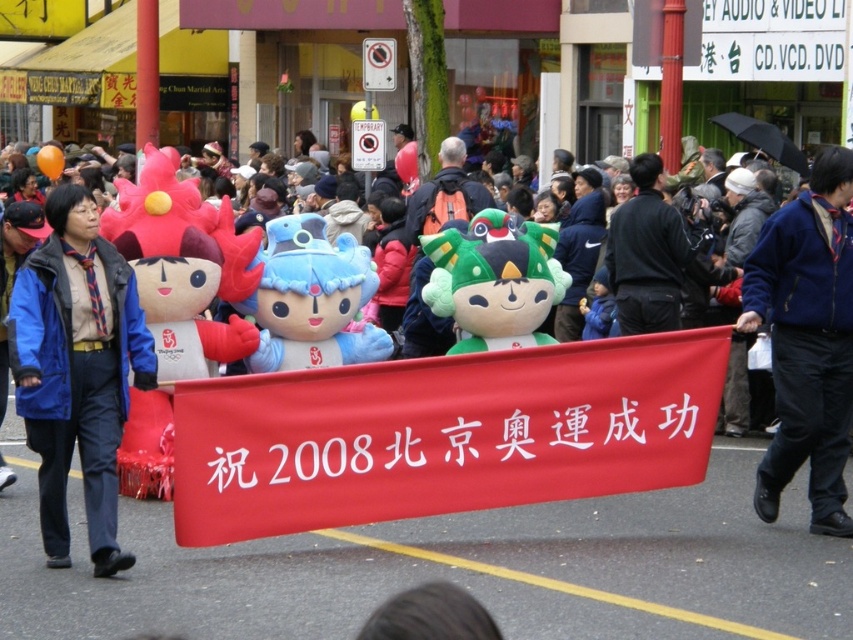
Question: Among these objects, which one is nearest to the camera?

Choices:
 (A) fluffy plush toy at center
 (B) red fabric banner at center
 (C) black matte jacket at center

Answer: (B)

Question: Is red fabric banner at center bigger than black matte jacket at center?

Choices:
 (A) no
 (B) yes

Answer: (B)

Question: Is the position of red fabric banner at center less distant than that of green plush toy at center?

Choices:
 (A) no
 (B) yes

Answer: (B)

Question: Based on their relative distances, which object is farther from the blue plush toy at center?

Choices:
 (A) red fabric banner at center
 (B) blue fleece jacket at center
 (C) blue fleece jacket at left

Answer: (B)

Question: Which point is farther from the camera taking this photo?

Choices:
 (A) (641, 326)
 (B) (807, 348)
 (C) (39, 448)
 (D) (322, 228)

Answer: (A)

Question: Does blue plush toy at center appear on the left side of green plush toy at center?

Choices:
 (A) yes
 (B) no

Answer: (A)